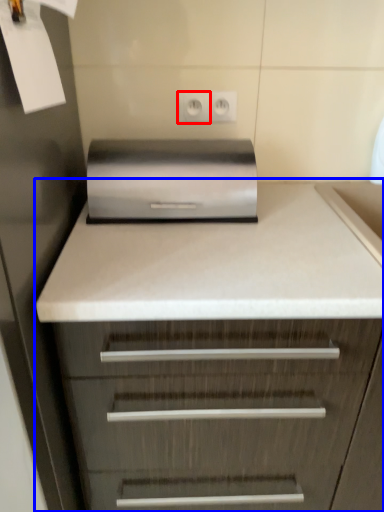
Question: Which object is closer to the camera taking this photo, electric outlet (highlighted by a red box) or chest of drawers (highlighted by a blue box)?

Choices:
 (A) electric outlet
 (B) chest of drawers

Answer: (B)